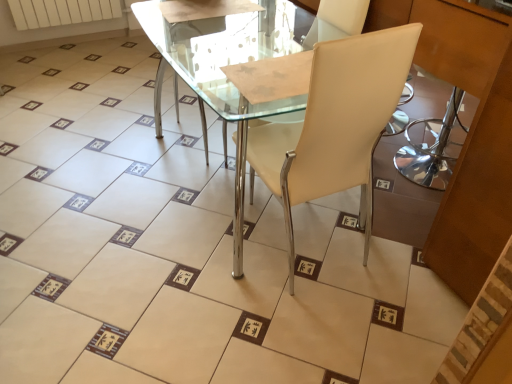
Question: Based on their positions, is white matte radiator at upper left located to the left or right of beige leather chair at center?

Choices:
 (A) right
 (B) left

Answer: (B)

Question: Is white matte radiator at upper left in front of or behind beige leather chair at center in the image?

Choices:
 (A) front
 (B) behind

Answer: (B)

Question: Estimate the real-world distances between objects in this image. Which object is farther from the transparent glass table at center?

Choices:
 (A) beige leather chair at center
 (B) white matte radiator at upper left

Answer: (B)

Question: Which object is the closest to the white matte radiator at upper left?

Choices:
 (A) beige leather chair at center
 (B) transparent glass table at center

Answer: (B)